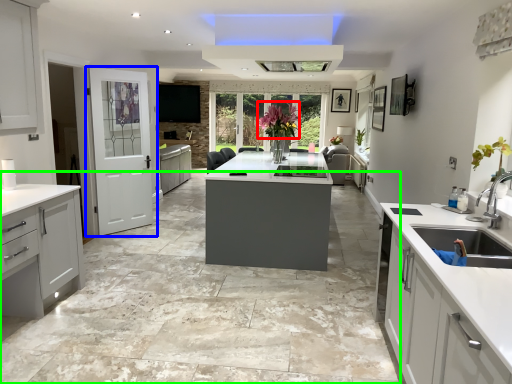
Question: Which object is positioned farthest from floral arrangement (highlighted by a red box)? Select from door (highlighted by a blue box) and concrete (highlighted by a green box).

Choices:
 (A) door
 (B) concrete

Answer: (B)